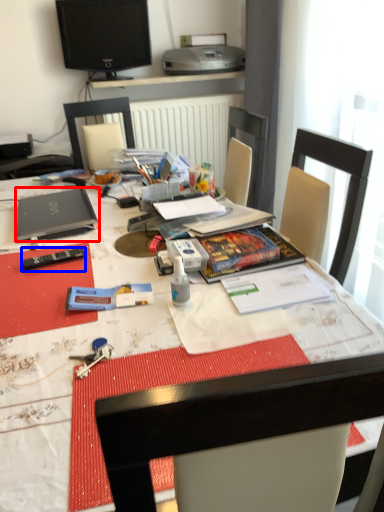
Question: Which of the following is the farthest to the observer, laptop (highlighted by a red box) or remote control (highlighted by a blue box)?

Choices:
 (A) laptop
 (B) remote control

Answer: (A)